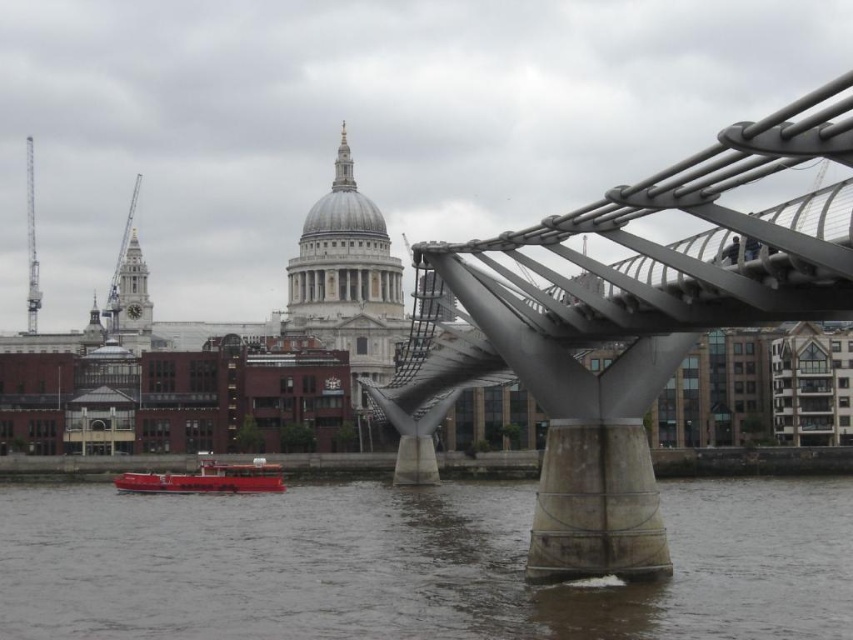
Does brown concrete river at lower center appear on the right side of polished steel bridge at center?

Incorrect, brown concrete river at lower center is not on the right side of polished steel bridge at center.

Which is above, brown concrete river at lower center or polished steel bridge at center?

polished steel bridge at center is above.

Image resolution: width=853 pixels, height=640 pixels. Find the location of `brown concrete river at lower center`. brown concrete river at lower center is located at coordinates (412, 564).

Image resolution: width=853 pixels, height=640 pixels. I want to click on brown concrete river at lower center, so click(x=412, y=564).

The width and height of the screenshot is (853, 640). I want to click on polished steel bridge at center, so click(x=630, y=321).

Can you confirm if brown concrete river at lower center is thinner than metallic red boat at lower left?

No, brown concrete river at lower center is not thinner than metallic red boat at lower left.

Does brown concrete river at lower center have a larger size compared to metallic red boat at lower left?

Correct, brown concrete river at lower center is larger in size than metallic red boat at lower left.

Is point (221, 573) positioned behind point (177, 490)?

That is False.

Find the location of a particular element. The height and width of the screenshot is (640, 853). brown concrete river at lower center is located at coordinates (412, 564).